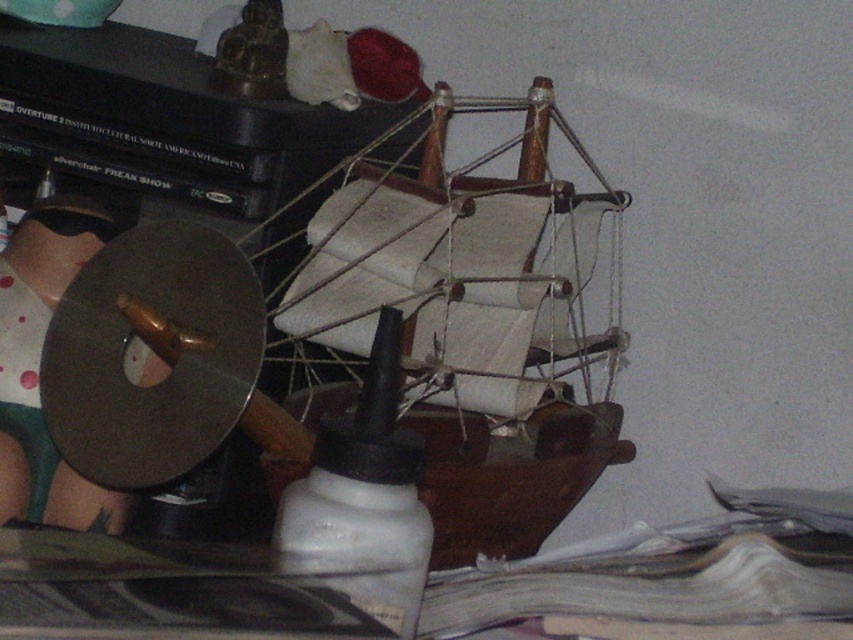
Is point (331, 557) in front of point (22, 381)?

Yes, point (331, 557) is closer to viewer.

How distant is white matte bottle at center from matte black disc at left?

They are 9.85 inches apart.

At what (x,y) coordinates should I click in order to perform the action: click on white matte bottle at center. Please return your answer as a coordinate pair (x, y). Looking at the image, I should click on (364, 496).

At what (x,y) coordinates should I click in order to perform the action: click on white matte bottle at center. Please return your answer as a coordinate pair (x, y). This screenshot has height=640, width=853. Looking at the image, I should click on (364, 496).